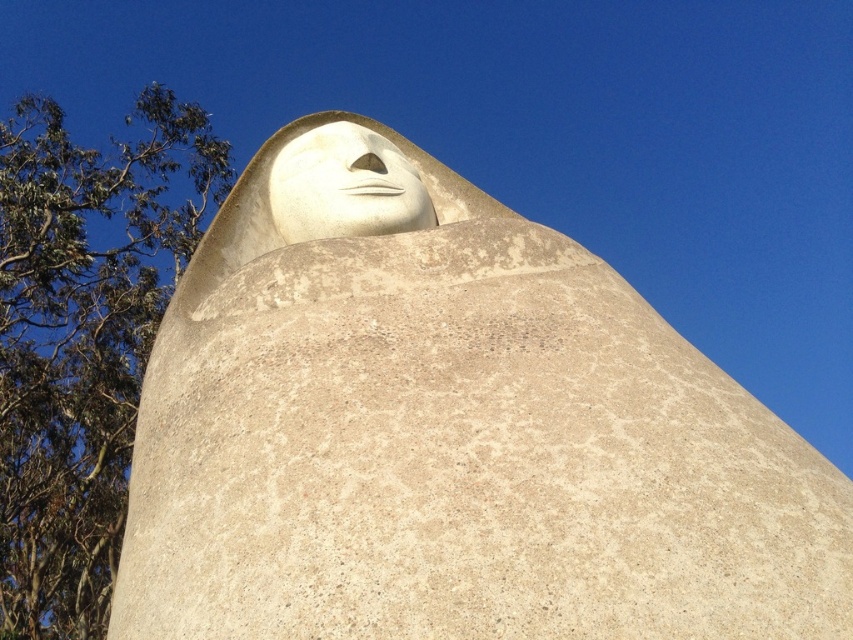
Question: Is white concrete face at upper center to the left of matte gray nose at center from the viewer's perspective?

Choices:
 (A) no
 (B) yes

Answer: (A)

Question: Considering the relative positions of white concrete face at upper center and white stone face at upper center in the image provided, where is white concrete face at upper center located with respect to white stone face at upper center?

Choices:
 (A) above
 (B) below

Answer: (B)

Question: Which object appears closest to the camera in this image?

Choices:
 (A) green leafy tree at upper left
 (B) matte gray nose at center
 (C) white stone face at upper center
 (D) white concrete face at upper center

Answer: (D)

Question: Does white concrete face at upper center have a lesser width compared to green leafy tree at upper left?

Choices:
 (A) yes
 (B) no

Answer: (A)

Question: Which is farther from the matte gray nose at center?

Choices:
 (A) white stone face at upper center
 (B) green leafy tree at upper left

Answer: (B)

Question: Which of the following is the farthest from the observer?

Choices:
 (A) (335, 180)
 (B) (383, 164)
 (C) (90, 492)

Answer: (C)